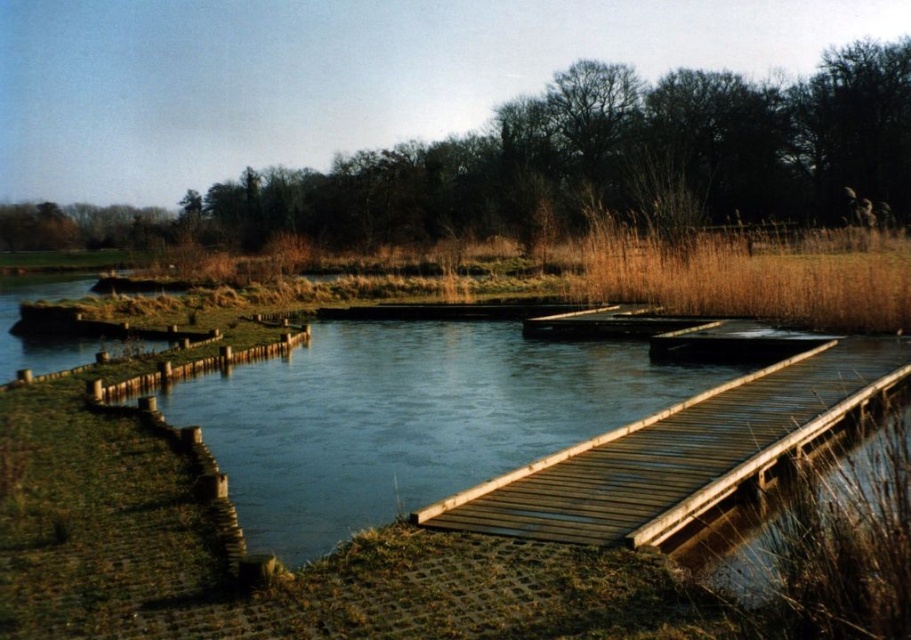
Question: Is wooden dock at center bigger than brown grass at upper right?

Choices:
 (A) no
 (B) yes

Answer: (A)

Question: Does wooden dock at center appear over brown grass at upper right?

Choices:
 (A) yes
 (B) no

Answer: (B)

Question: Which point is farther to the camera?

Choices:
 (A) wooden dock at center
 (B) brown grass at upper right

Answer: (B)

Question: Among these points, which one is nearest to the camera?

Choices:
 (A) (862, 259)
 (B) (687, 484)

Answer: (B)

Question: Is wooden dock at center positioned at the back of brown grass at upper right?

Choices:
 (A) no
 (B) yes

Answer: (A)